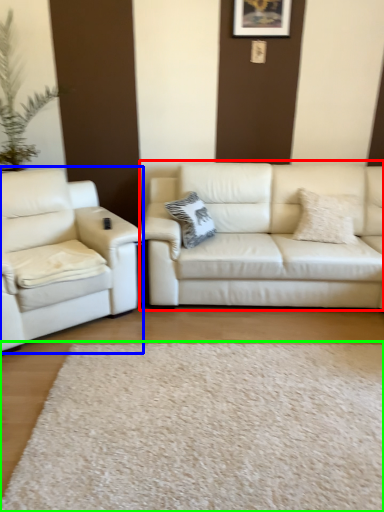
Question: Estimate the real-world distances between objects in this image. Which object is farther from studio couch (highlighted by a red box), studio couch (highlighted by a blue box) or plain (highlighted by a green box)?

Choices:
 (A) studio couch
 (B) plain

Answer: (B)